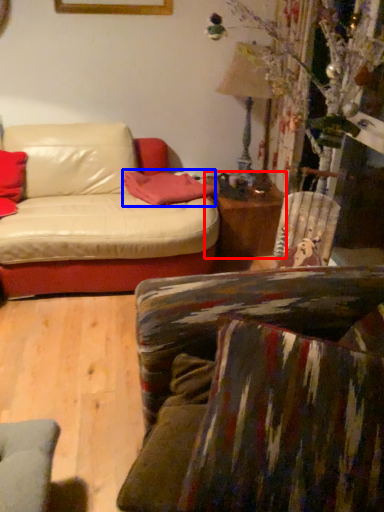
Question: Which of the following is the closest to the observer, table (highlighted by a red box) or pillow (highlighted by a blue box)?

Choices:
 (A) table
 (B) pillow

Answer: (B)